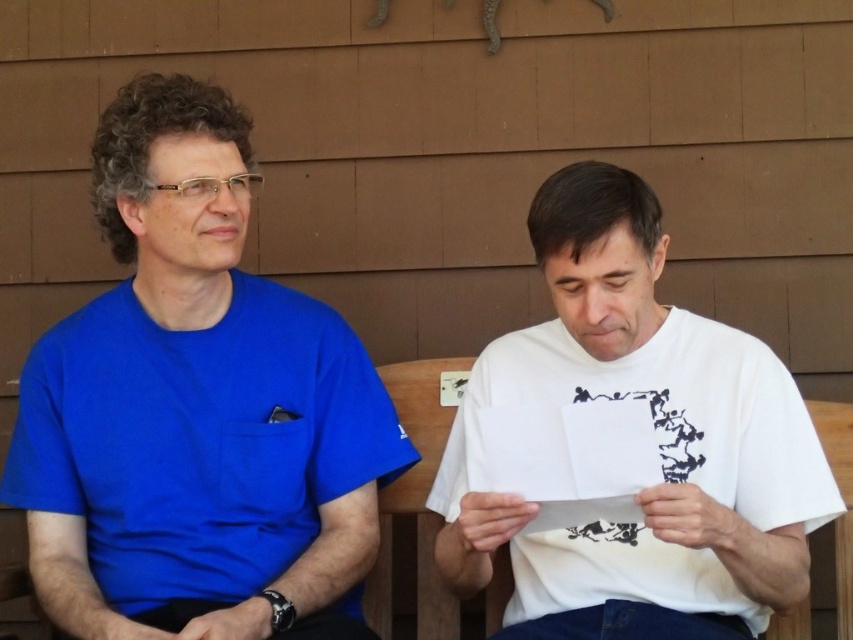
From the picture: Can you confirm if blue smooth t-shirt at left is positioned to the right of white matte paper at center?

Result: Incorrect, blue smooth t-shirt at left is not on the right side of white matte paper at center.

Who is more forward, (x=154, y=616) or (x=608, y=259)?

Positioned in front is point (x=608, y=259).

Does point (187, 540) come in front of point (556, 355)?

Yes, it is in front of point (556, 355).

Identify the location of blue smooth t-shirt at left. The image size is (853, 640). (196, 410).